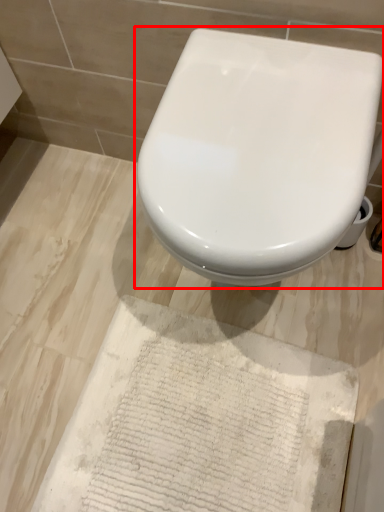
Question: Where is toilet (annotated by the red box) located in relation to parchment in the image?

Choices:
 (A) left
 (B) right

Answer: (B)